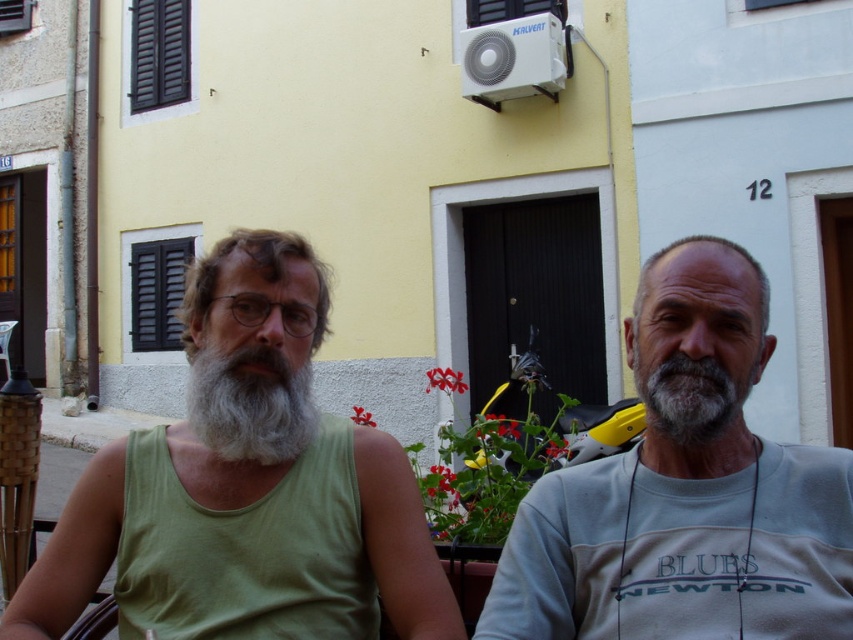
Between green fabric shirt at center and graywoollybeard at left, which one is positioned lower?

Positioned lower is green fabric shirt at center.

Which is behind, point (703, 448) or point (247, 408)?

Point (247, 408)

The image size is (853, 640). What are the coordinates of `green fabric shirt at center` in the screenshot? It's located at (698, 356).

Which is above, gray cotton t-shirt at center or green fabric shirt at center?

gray cotton t-shirt at center is above.

What do you see at coordinates (686, 490) in the screenshot? I see `gray cotton t-shirt at center` at bounding box center [686, 490].

Is point (670, 529) in front of point (705, 356)?

No, (670, 529) is further to viewer.

At what (x,y) coordinates should I click in order to perform the action: click on gray cotton t-shirt at center. Please return your answer as a coordinate pair (x, y). This screenshot has height=640, width=853. Looking at the image, I should click on (686, 490).

Does green fabric shirt at center have a greater height compared to gray cotton shirt at right?

Correct, green fabric shirt at center is much taller as gray cotton shirt at right.

Does green fabric shirt at center appear on the right side of gray cotton shirt at right?

No, green fabric shirt at center is not to the right of gray cotton shirt at right.

Does point (410, 566) lie behind point (641, 584)?

Yes.

Where is `green fabric shirt at center`? green fabric shirt at center is located at coordinates (698, 356).